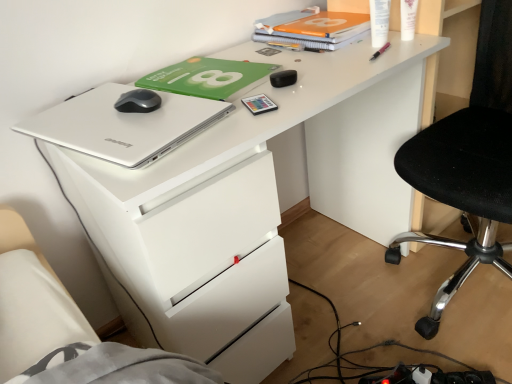
Locate an element on the screen. vacant region to the left of pink plastic pen at upper right, which appears as the third stationery when viewed from the top is located at coordinates (316, 61).